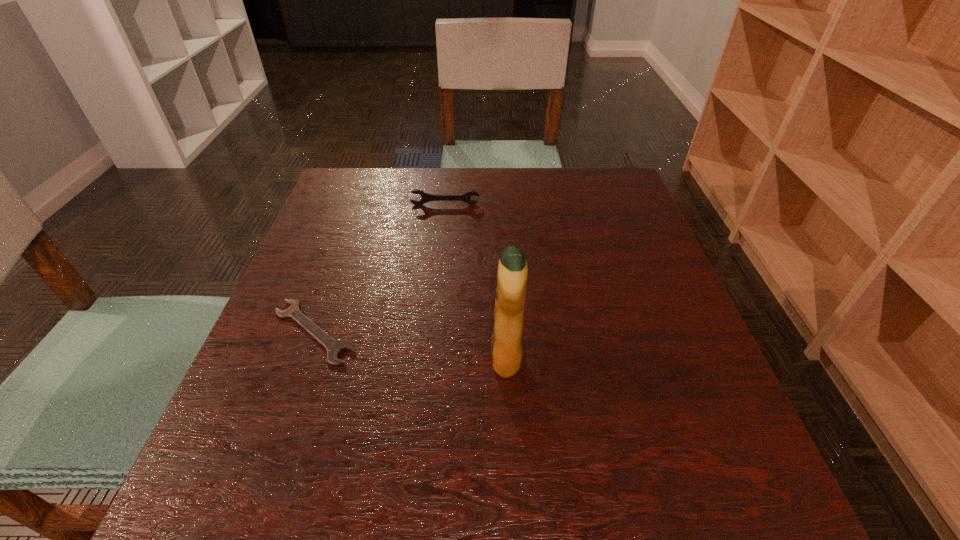
At what (x,y) coordinates should I click in order to perform the action: click on the tallest object. Please return your answer as a coordinate pair (x, y). This screenshot has height=540, width=960. Looking at the image, I should click on (506, 344).

In order to click on detergent in this screenshot , I will do `click(506, 344)`.

Find the location of a particular element. the second object from left to right is located at coordinates (425, 197).

I want to click on the right wrench, so click(425, 197).

Where is `the leftmost object`? This screenshot has width=960, height=540. the leftmost object is located at coordinates (334, 347).

Identify the location of the shorter wrench. (334, 347).

The width and height of the screenshot is (960, 540). I want to click on free space located on the label of the rightmost object, so click(408, 357).

Where is `free location located 0.250m on the label of the rightmost object`? The height and width of the screenshot is (540, 960). free location located 0.250m on the label of the rightmost object is located at coordinates (353, 357).

The height and width of the screenshot is (540, 960). I want to click on blank area located 0.390m on the label of the rightmost object, so click(276, 357).

At what (x,y) coordinates should I click in order to perform the action: click on free space located on the open ends of the second shortest object. Please return your answer as a coordinate pair (x, y). This screenshot has width=960, height=540. Looking at the image, I should click on (443, 231).